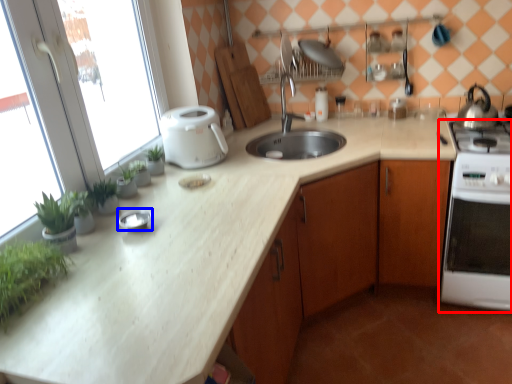
Question: Which object appears farthest to the camera in this image, home appliance (highlighted by a red box) or appliance (highlighted by a blue box)?

Choices:
 (A) home appliance
 (B) appliance

Answer: (A)